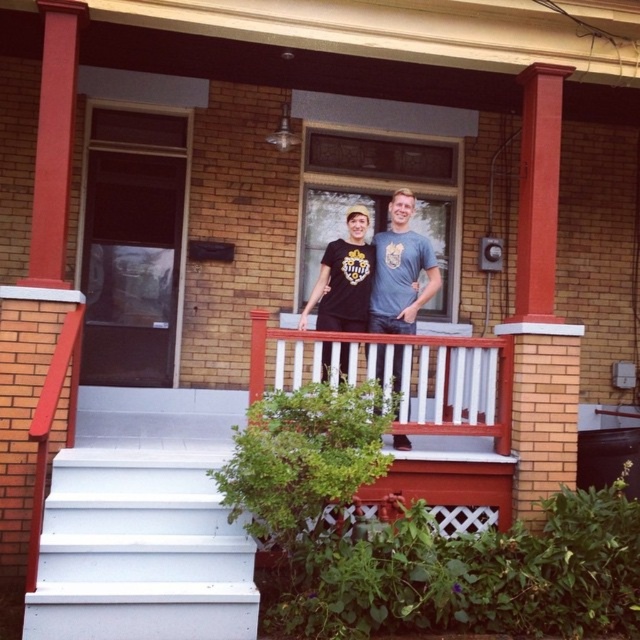
Looking at this image, does brick column at center lie in front of white painted wood at center?

No, it is not.

Does brick column at center have a larger size compared to white painted wood at center?

No, brick column at center is not bigger than white painted wood at center.

What do you see at coordinates (540, 307) in the screenshot? I see `brick column at center` at bounding box center [540, 307].

Locate an element on the screen. This screenshot has height=640, width=640. brick column at center is located at coordinates (540, 307).

Does point (83, 493) come farther from viewer compared to point (396, 326)?

No, it is not.

Looking at this image, between white painted wood stairs at lower left and matte gray t-shirt at center, which one has less height?

white painted wood stairs at lower left

Identify the location of white painted wood stairs at lower left. This screenshot has width=640, height=640. (144, 524).

Locate an element on the screen. This screenshot has height=640, width=640. white painted wood stairs at lower left is located at coordinates (x=144, y=524).

Between brick column at center and matte gray t-shirt at center, which one has more height?

Standing taller between the two is brick column at center.

Does brick column at center appear under matte gray t-shirt at center?

Correct, brick column at center is located below matte gray t-shirt at center.

This screenshot has width=640, height=640. I want to click on brick column at center, so click(540, 307).